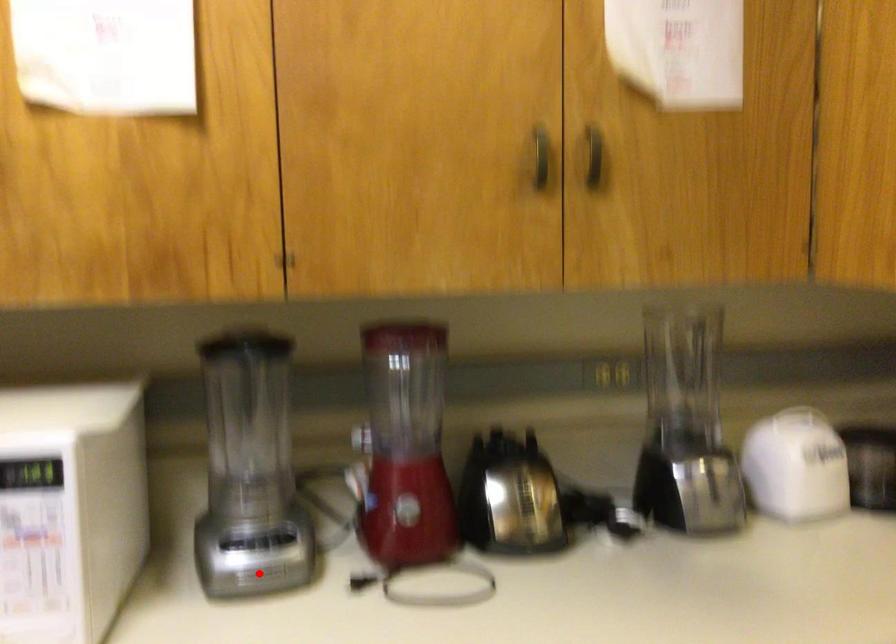
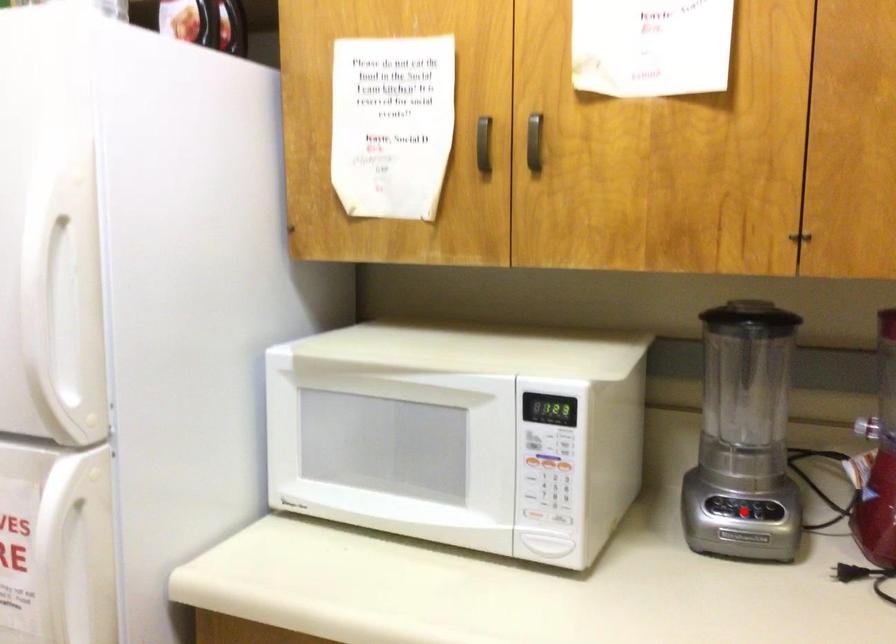
Looking at this image, I am providing you with two images of the same scene from different viewpoints. A red point is marked on the first image and another point is marked on the second image. Is the marked point in image1 the same physical position as the marked point in image2?

No